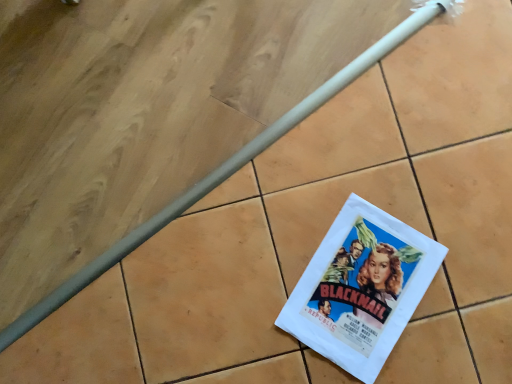
Locate an element on the screen. This screenshot has width=512, height=384. empty space that is ontop of white paper poster at center (from a real-world perspective) is located at coordinates (361, 285).